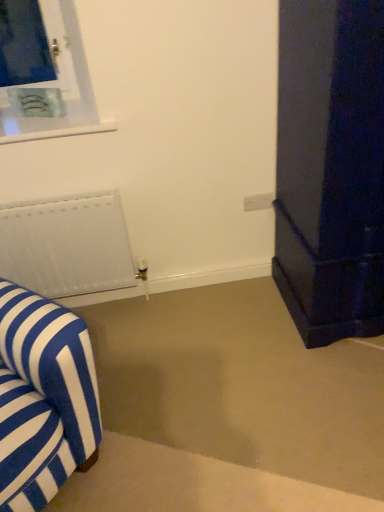
Question: From a real-world perspective, is blue and white striped fabric armchair at left above or below white plastic electric outlet at center?

Choices:
 (A) below
 (B) above

Answer: (A)

Question: From the image's perspective, is blue and white striped fabric armchair at left positioned above or below white plastic electric outlet at center?

Choices:
 (A) above
 (B) below

Answer: (B)

Question: Which object is positioned farthest from the white plastic electric outlet at center?

Choices:
 (A) white matte radiator at left
 (B) blue and white striped fabric armchair at left

Answer: (B)

Question: Which is farther from the white matte radiator at left?

Choices:
 (A) blue and white striped fabric armchair at left
 (B) white plastic electric outlet at center

Answer: (B)